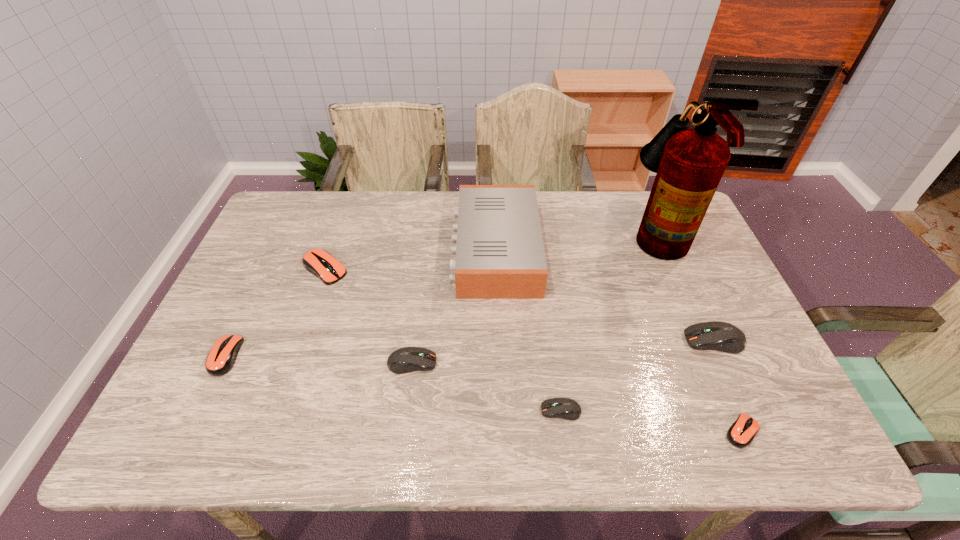
Identify the location of free space located on the control panel of the seventh shortest object. (351, 249).

Identify the location of free space located 0.080m on the button of the biggest dark computer equipment. The image size is (960, 540). (653, 341).

Image resolution: width=960 pixels, height=540 pixels. I want to click on blank space located 0.090m on the button of the biggest dark computer equipment, so pyautogui.click(x=649, y=341).

Identify the location of vacant space located 0.140m on the button of the biggest dark computer equipment. This screenshot has height=540, width=960. (630, 341).

I want to click on vacant space situated on the right of the second orange computer mouse from right to left, so click(x=437, y=269).

Image resolution: width=960 pixels, height=540 pixels. What are the coordinates of `free space located on the button of the fourth computer mouse from right to left` in the screenshot? It's located at (535, 363).

Identify the location of vacant space located on the right of the second biggest orange computer mouse. The width and height of the screenshot is (960, 540). (372, 356).

I want to click on free space located 0.150m on the button of the nearest dark computer equipment, so click(474, 410).

You are a GUI agent. You are given a task and a screenshot of the screen. Output one action in this format:
    pyautogui.click(x=<x>, y=<y>)
    Task: Click on the vacant space located on the button of the nearest dark computer equipment
    Image resolution: width=960 pixels, height=540 pixels.
    Given the screenshot: What is the action you would take?
    pyautogui.click(x=380, y=410)

At what (x,y) coordinates should I click in order to perform the action: click on vacant region located 0.250m on the button of the nearest dark computer equipment. Please return your answer as a coordinate pair (x, y). Image resolution: width=960 pixels, height=540 pixels. Looking at the image, I should click on (429, 410).